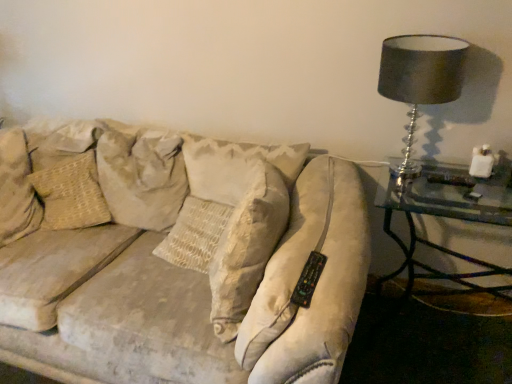
Question: From a real-world perspective, is beige textured pillow at left, which ranks as the 1th pillow in left-to-right order, on top of matte black lampshade at upper right?

Choices:
 (A) yes
 (B) no

Answer: (B)

Question: Can you confirm if beige textured pillow at left, which ranks as the 1th pillow in left-to-right order, is smaller than matte black lampshade at upper right?

Choices:
 (A) no
 (B) yes

Answer: (A)

Question: Is beige textured pillow at left, the second pillow when ordered from right to left, facing towards matte black lampshade at upper right?

Choices:
 (A) yes
 (B) no

Answer: (B)

Question: Can you confirm if beige textured pillow at left, which ranks as the 1th pillow in left-to-right order, is bigger than matte black lampshade at upper right?

Choices:
 (A) no
 (B) yes

Answer: (B)

Question: Are beige textured pillow at left, which ranks as the 1th pillow in left-to-right order, and matte black lampshade at upper right located far from each other?

Choices:
 (A) yes
 (B) no

Answer: (A)

Question: Is beige textured pillow at left, the second pillow when ordered from right to left, oriented away from matte black lampshade at upper right?

Choices:
 (A) no
 (B) yes

Answer: (A)

Question: Is beige textured pillow at left, which ranks as the 1th pillow in left-to-right order, not near clear glass table at right?

Choices:
 (A) yes
 (B) no

Answer: (A)

Question: From a real-world perspective, is beige textured pillow at left, which ranks as the 1th pillow in left-to-right order, on clear glass table at right?

Choices:
 (A) yes
 (B) no

Answer: (A)

Question: Is beige textured pillow at left, the second pillow when ordered from right to left, taller than clear glass table at right?

Choices:
 (A) yes
 (B) no

Answer: (B)

Question: Is beige textured pillow at left, the second pillow when ordered from right to left, directly adjacent to clear glass table at right?

Choices:
 (A) no
 (B) yes

Answer: (A)

Question: Does beige textured pillow at left, the second pillow when ordered from right to left, have a smaller size compared to clear glass table at right?

Choices:
 (A) yes
 (B) no

Answer: (A)

Question: Does beige textured pillow at left, the second pillow when ordered from right to left, appear on the right side of clear glass table at right?

Choices:
 (A) no
 (B) yes

Answer: (A)

Question: From the image's perspective, is beige fabric pillow at upper left, which is counted as the 1th pillow, starting from the right, on clear glass table at right?

Choices:
 (A) yes
 (B) no

Answer: (A)